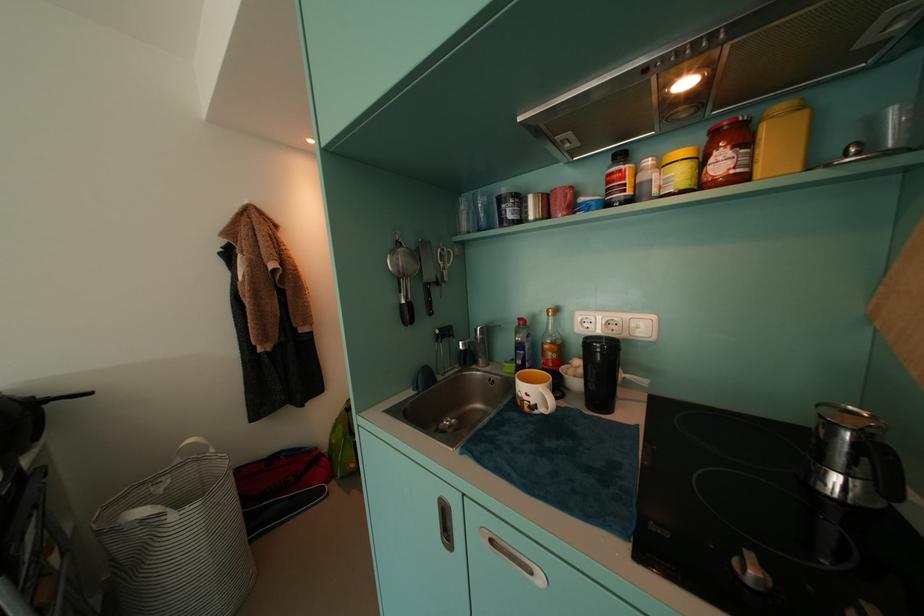
Find where to turn the black container lid. Please return your answer as a coordinate pair (x, y).

(767, 519)